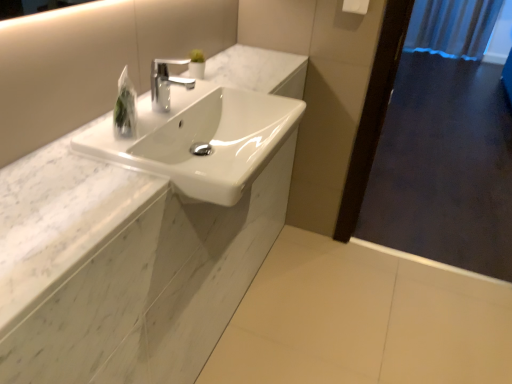
Question: Could you tell me if white plastic towel bar at upper right is facing blue fabric shower curtain at upper right?

Choices:
 (A) yes
 (B) no

Answer: (B)

Question: From a real-world perspective, is white plastic towel bar at upper right physically above blue fabric shower curtain at upper right?

Choices:
 (A) yes
 (B) no

Answer: (A)

Question: From the image's perspective, is white plastic towel bar at upper right over blue fabric shower curtain at upper right?

Choices:
 (A) no
 (B) yes

Answer: (A)

Question: Is white plastic towel bar at upper right outside of blue fabric shower curtain at upper right?

Choices:
 (A) no
 (B) yes

Answer: (B)

Question: Is white plastic towel bar at upper right touching blue fabric shower curtain at upper right?

Choices:
 (A) no
 (B) yes

Answer: (A)

Question: Considering the relative positions of white plastic towel bar at upper right and blue fabric shower curtain at upper right in the image provided, is white plastic towel bar at upper right behind blue fabric shower curtain at upper right?

Choices:
 (A) yes
 (B) no

Answer: (B)

Question: Would you say clear plastic bag at upper center is a long distance from polished chrome faucet at center?

Choices:
 (A) yes
 (B) no

Answer: (B)

Question: From a real-world perspective, is clear plastic bag at upper center beneath polished chrome faucet at center?

Choices:
 (A) no
 (B) yes

Answer: (B)

Question: Does clear plastic bag at upper center have a greater width compared to polished chrome faucet at center?

Choices:
 (A) no
 (B) yes

Answer: (A)

Question: Does clear plastic bag at upper center have a larger size compared to polished chrome faucet at center?

Choices:
 (A) yes
 (B) no

Answer: (B)

Question: Is clear plastic bag at upper center thinner than polished chrome faucet at center?

Choices:
 (A) yes
 (B) no

Answer: (A)

Question: Is clear plastic bag at upper center further to the viewer compared to polished chrome faucet at center?

Choices:
 (A) no
 (B) yes

Answer: (A)

Question: Would you say dark wood screen door at right is outside white marble counter at center?

Choices:
 (A) yes
 (B) no

Answer: (A)